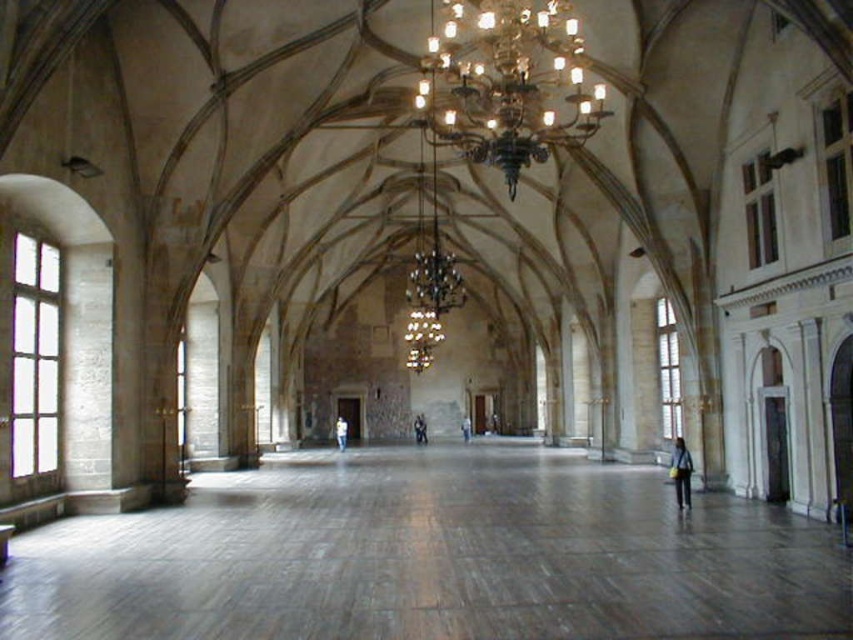
You are standing in the grand hall and want to know if the gold metallic chandelier at upper center is within a safe distance for a maintenance worker to reach using a standard ladder. The standard ladder can extend up to 5 meters. Is the chandelier within reach?

The gold metallic chandelier at upper center is 54.58 meters away from the viewer. Since the ladder can only extend up to 5 meters, the chandelier is far beyond the reach of the ladder. A taller ladder or specialized equipment would be required for maintenance.

You are standing in the grand hall and see the light blue denim jacket at lower right. Where exactly is it located in the hall?

The light blue denim jacket at lower right is located at point [680,472].

You are standing in the grand hall and want to take a photo. There are two points of interest marked at coordinates point (679, 472) and point (463, 416). Which point should you focus on first if you want to capture the closest object to the camera in your shot?

Point (679, 472) is closer to the camera than point (463, 416), so you should focus on point (679, 472) first to capture the closest object in your shot.